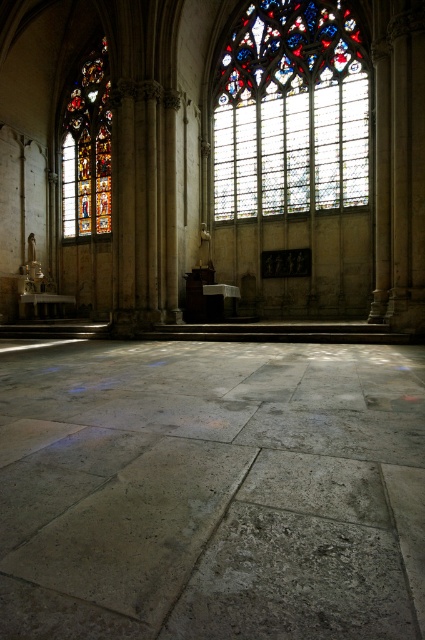
You are standing inside the grand cathedral and want to take a photo of both the stained glass window at center and the stained glass window at left. Which window is positioned lower in the cathedral? Please describe their vertical positions relative to each other.

The stained glass window at center is located below the stained glass window at left, meaning the one at the center is lower down compared to the left one.

You are standing in the center of the church and want to take a photo of both the stained glass window at center and the stained glass window at left. Which direction should you turn to include both in your frame?

You should turn to the left because the stained glass window at center is to the right of the stained glass window at left, so turning left will position both windows within your camera frame.

You are standing at the entrance of the grand cathedral and want to take a photo of the stained glass window at center. If the camera is at your eye level, which is at point coordinates of 0.5, 0.5, will the window be visible in your photo? Please explain based on the window and your position coordinates.

The stained glass window at center is located at coordinates [291,112]. Your eye level is at [212,320]. Since the window is positioned higher up and to the left compared to your eye level, it should be visible in the photo as long as the camera is pointed in that direction.